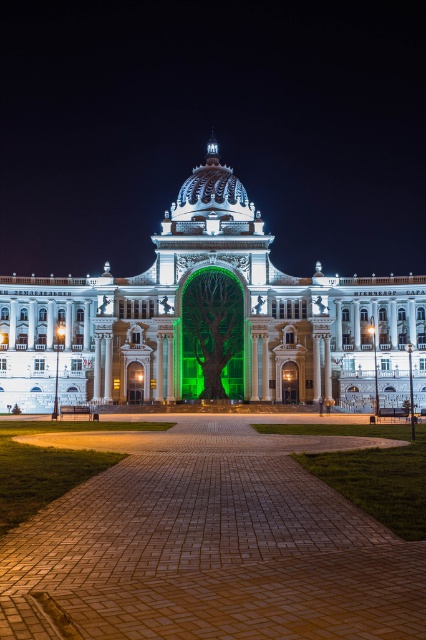
Question: Estimate the real-world distances between objects in this image. Which object is farther from the brick paved plaza at center?

Choices:
 (A) green matte tree at center
 (B) white marble palace at center

Answer: (B)

Question: Can you confirm if brick paved plaza at center is wider than green matte tree at center?

Choices:
 (A) yes
 (B) no

Answer: (A)

Question: Among these objects, which one is farthest from the camera?

Choices:
 (A) white marble palace at center
 (B) brick paved plaza at center

Answer: (A)

Question: Which object is positioned farthest from the brick paved plaza at center?

Choices:
 (A) green matte tree at center
 (B) white marble palace at center

Answer: (B)

Question: Considering the relative positions of brick paved plaza at center and white marble palace at center in the image provided, where is brick paved plaza at center located with respect to white marble palace at center?

Choices:
 (A) below
 (B) above

Answer: (A)

Question: Is brick paved plaza at center behind white marble palace at center?

Choices:
 (A) no
 (B) yes

Answer: (A)